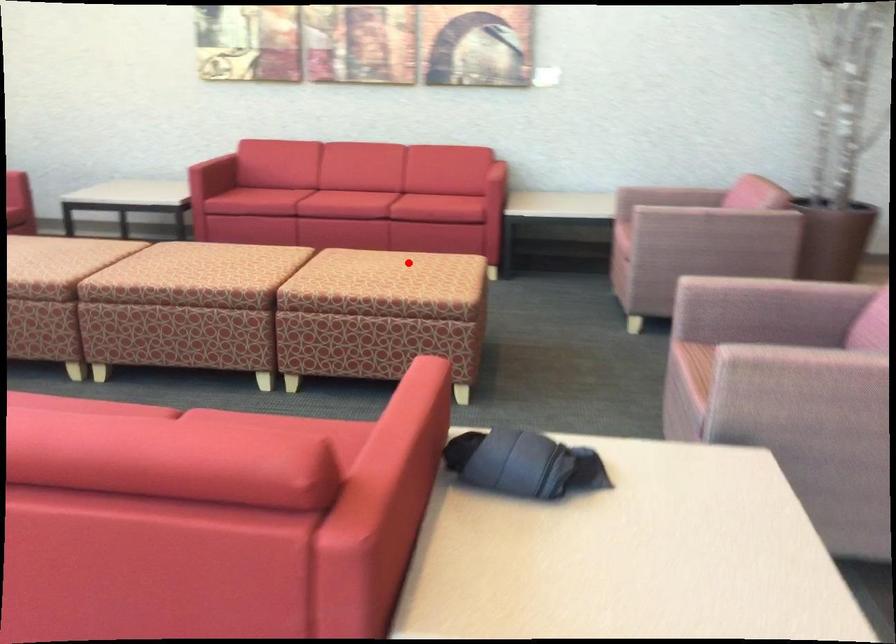
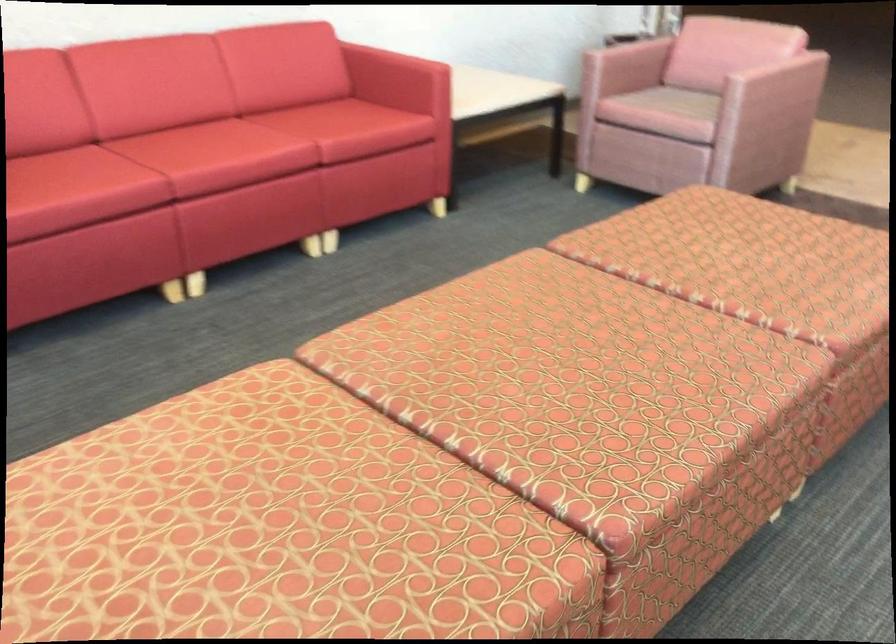
Question: A red point is marked in image1. In image2, is the corresponding 3D point closer to the camera or farther? Reply with the corresponding letter.

Choices:
 (A) The corresponding 3D point is closer.
 (B) The corresponding 3D point is farther.

Answer: (A)